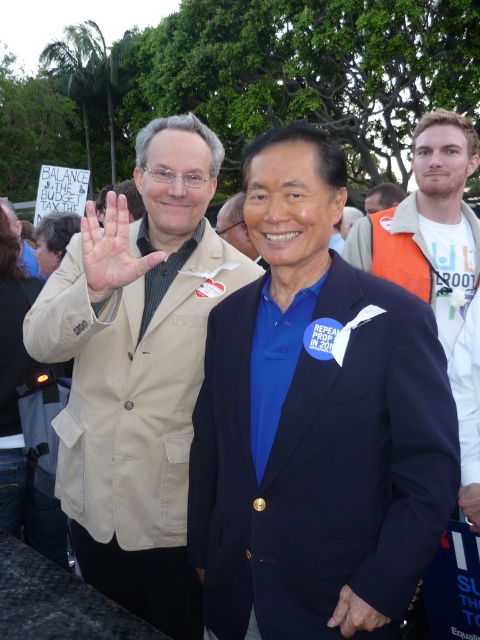
Question: In this image, where is navy wool blazer at center located relative to blue fabric shirt at center?

Choices:
 (A) right
 (B) left

Answer: (A)

Question: Can you confirm if orange fleece vest at right is thinner than blue fabric shirt at center?

Choices:
 (A) yes
 (B) no

Answer: (B)

Question: Which object is the farthest from the blue fabric shirt at center?

Choices:
 (A) matte black jacket at center
 (B) orange fleece vest at right
 (C) light skin hand at center
 (D) matte khaki jacket at left

Answer: (A)

Question: Which point appears closest to the camera in this image?

Choices:
 (A) (126, 230)
 (B) (218, 218)
 (C) (62, 244)

Answer: (A)

Question: Which point is closer to the camera?

Choices:
 (A) matte black hair at lower left
 (B) matte black jacket at center
 (C) navy wool blazer at center

Answer: (C)

Question: Does orange fleece vest at right have a greater width compared to matte black jacket at center?

Choices:
 (A) no
 (B) yes

Answer: (A)